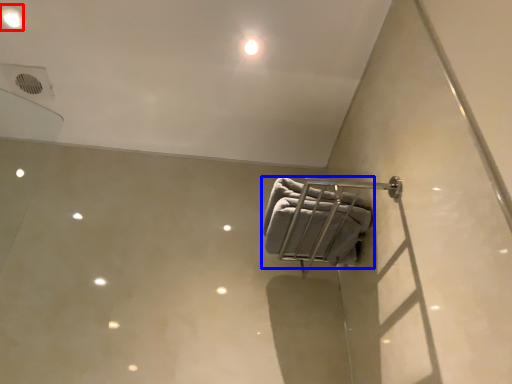
Question: Among these objects, which one is nearest to the camera, dot (highlighted by a red box) or towel (highlighted by a blue box)?

Choices:
 (A) dot
 (B) towel

Answer: (B)